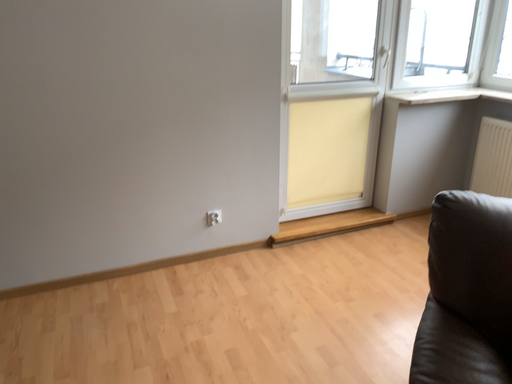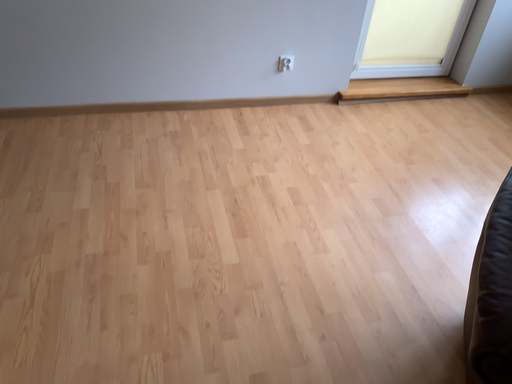
Question: Which way did the camera rotate in the video?

Choices:
 (A) rotated upward
 (B) rotated downward

Answer: (B)